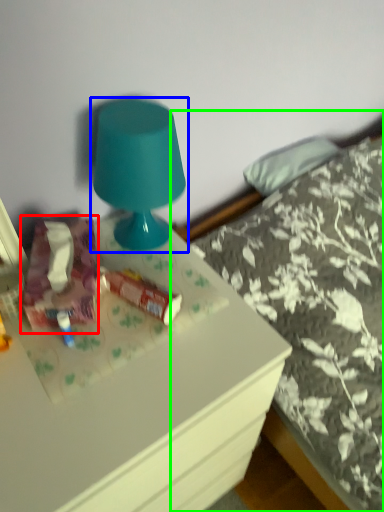
Question: Which is nearer to the stuff (highlighted by a red box)? lamp (highlighted by a blue box) or bed (highlighted by a green box).

Choices:
 (A) lamp
 (B) bed

Answer: (A)